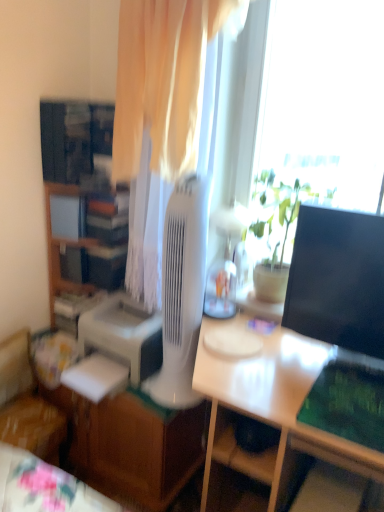
Question: Is white glossy desk at lower left, arranged as the 1th desk when viewed from the left, inside or outside of wooden fabric chair at lower left?

Choices:
 (A) outside
 (B) inside

Answer: (A)

Question: From the image's perspective, is white glossy desk at lower left, arranged as the 1th desk when viewed from the left, above or below wooden fabric chair at lower left?

Choices:
 (A) above
 (B) below

Answer: (B)

Question: Considering the real-world distances, which object is closest to the wooden fabric chair at lower left?

Choices:
 (A) white glossy desk at center, positioned as the 2th desk in left-to-right order
 (B) white glossy desk at lower left, arranged as the 1th desk when viewed from the left
 (C) white plastic mechanical fan at center
 (D) green matte plant at center
 (E) wooden cabinet at left

Answer: (B)

Question: Estimate the real-world distances between objects in this image. Which object is farther from the white glossy desk at center, positioned as the 2th desk in left-to-right order?

Choices:
 (A) wooden cabinet at left
 (B) white plastic mechanical fan at center
 (C) black glossy monitor at right
 (D) green matte plant at center
 (E) white glossy desk at lower left, the second desk in the right-to-left sequence

Answer: (A)